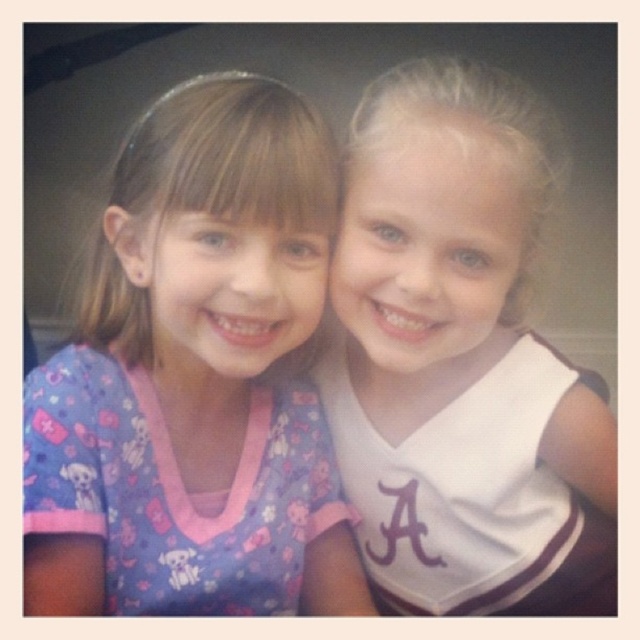
You are a photographer trying to capture a closeup of the purple fabric shirt at center and the white jersey at center. Which one should you focus on first if you want to ensure both are in focus?

The purple fabric shirt at center is above the white jersey at center, so focusing on the purple fabric shirt at center first will help ensure both are in focus as it is closer to the camera.

You are a photographer adjusting the camera focus. The two children are sitting with their shirts visible. The purple fabric shirt at center and the white jersey at center are 6.48 inches apart. Can you fit both shirts into a camera frame that can only capture objects within a 6 inch width?

The purple fabric shirt at center and white jersey at center are 6.48 inches apart, which exceeds the 6 inch width capacity of the camera frame. Therefore, both shirts cannot be fully captured within the frame simultaneously.

You are organizing a school photo day and need to ensure all shirts fit properly. The purple fabric shirt at center and the white jersey at center are both for the same child. Based on the image, which shirt has a narrower width?

The purple fabric shirt at center has a narrower width compared to the white jersey at center, as stated in the description that the purple fabric shirt at center is less wide than the white jersey at center.